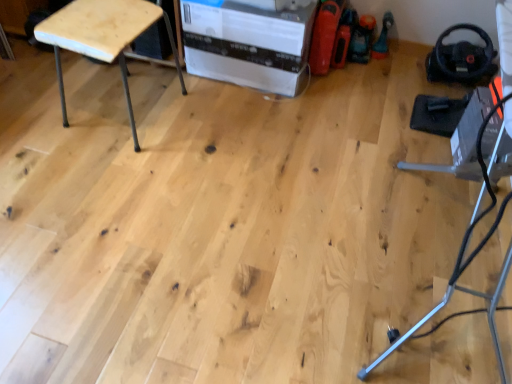
Locate an element on the screen. vacant area that is in front of white cardboard box at center is located at coordinates (250, 138).